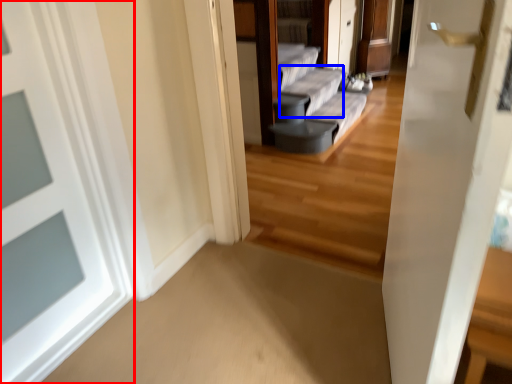
Question: Which of the following is the closest to the observer, door (highlighted by a red box) or couch (highlighted by a blue box)?

Choices:
 (A) door
 (B) couch

Answer: (A)